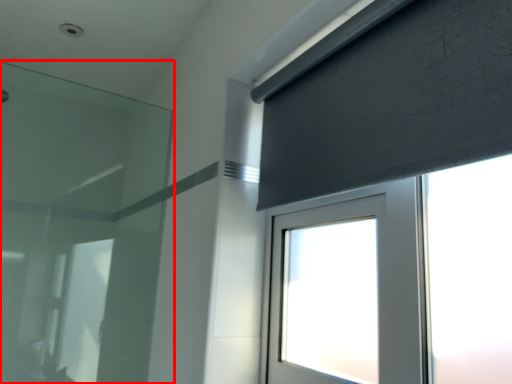
Question: In this image, where is filter (annotated by the red box) located relative to curtain?

Choices:
 (A) left
 (B) right

Answer: (A)